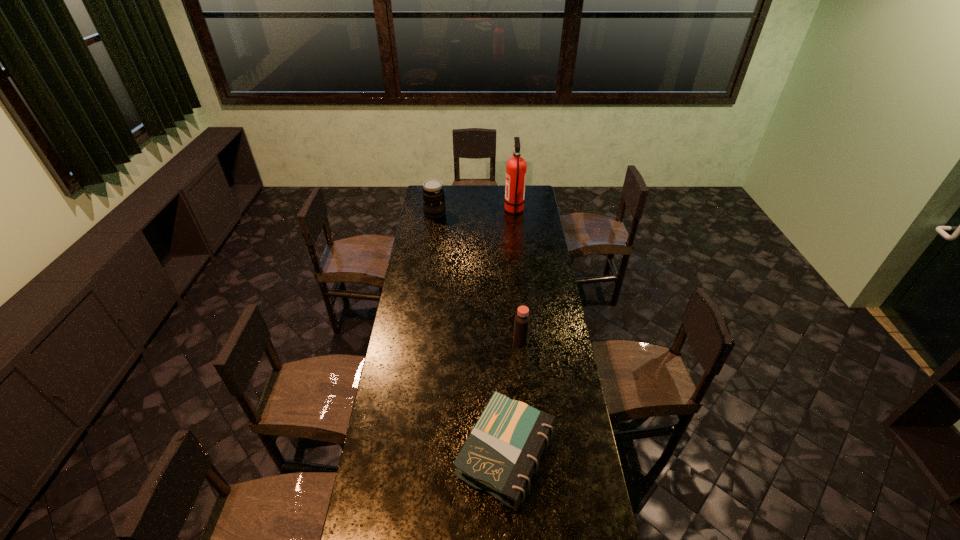
The image size is (960, 540). Find the location of `vacant space located 0.130m on the back of the shortest object`. vacant space located 0.130m on the back of the shortest object is located at coordinates (503, 377).

You are a GUI agent. You are given a task and a screenshot of the screen. Output one action in this format:
    pyautogui.click(x=<x>, y=<y>)
    Task: Click on the object that is positioned at the far edge
    The image size is (960, 540).
    Given the screenshot: What is the action you would take?
    pyautogui.click(x=516, y=166)

Where is `object that is at the left edge`? The image size is (960, 540). object that is at the left edge is located at coordinates (433, 194).

Where is `fire extinguisher at the right edge`? The height and width of the screenshot is (540, 960). fire extinguisher at the right edge is located at coordinates (516, 166).

Locate an element on the screen. paperback book that is at the right edge is located at coordinates (502, 452).

Find the location of a particular element. The width and height of the screenshot is (960, 540). object that is at the far right corner is located at coordinates (516, 166).

This screenshot has width=960, height=540. What are the coordinates of `vacant space at the far edge` in the screenshot? It's located at (499, 204).

At what (x,y) coordinates should I click in order to perform the action: click on free space at the left edge of the desktop. Please return your answer as a coordinate pair (x, y). Image resolution: width=960 pixels, height=540 pixels. Looking at the image, I should click on (432, 232).

Find the location of `vacant area at the right edge of the desktop`. vacant area at the right edge of the desktop is located at coordinates (541, 388).

Where is `free space between the leftmost object and the second nearest object`? The image size is (960, 540). free space between the leftmost object and the second nearest object is located at coordinates (478, 277).